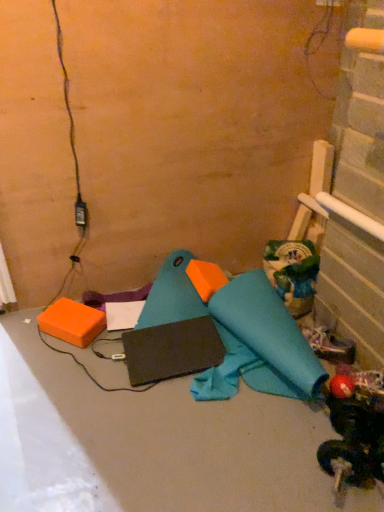
Find the location of a particular element. The image size is (384, 512). vacant area that is in front of black matte laptop at center is located at coordinates (174, 420).